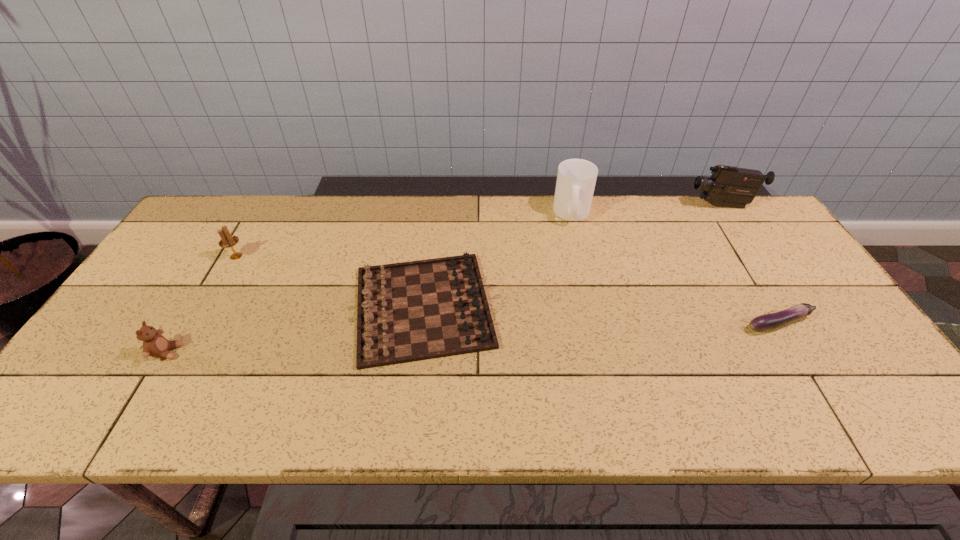
I want to click on vacant area situated on the front-facing side of the camcorder, so click(x=607, y=206).

At what (x,y) coordinates should I click in order to perform the action: click on free space located 0.260m on the back of the third tallest object. Please return your answer as a coordinate pair (x, y). The image size is (960, 540). Looking at the image, I should click on (270, 199).

Find the location of `vacant region located 0.120m on the front-facing side of the teddy bear`. vacant region located 0.120m on the front-facing side of the teddy bear is located at coordinates (230, 352).

Image resolution: width=960 pixels, height=540 pixels. Identify the location of vacant region located 0.090m on the back of the chessboard. (432, 237).

Locate an element on the screen. vacant region located on the left of the eggplant is located at coordinates (647, 323).

Find the location of a particular element. mug present at the far edge is located at coordinates (576, 179).

Identify the location of camcorder that is at the far edge. The width and height of the screenshot is (960, 540). (730, 186).

Find the location of a particular element. This screenshot has height=540, width=960. object at the left edge is located at coordinates (154, 344).

Find the location of a particular element. Image resolution: width=960 pixels, height=540 pixels. camcorder that is at the right edge is located at coordinates (730, 186).

This screenshot has height=540, width=960. Identify the location of eggplant located in the right edge section of the desktop. (770, 321).